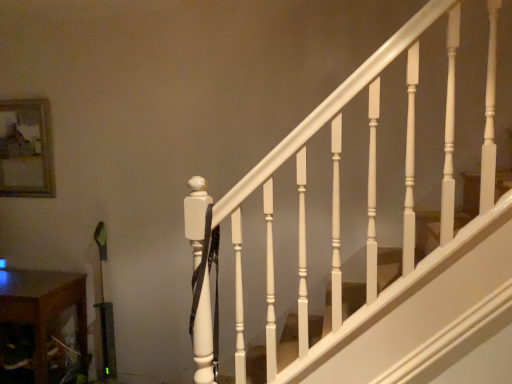
Question: Would you say wooden at lower left is to the left or to the right of wooden frame at upper left in the picture?

Choices:
 (A) left
 (B) right

Answer: (B)

Question: Is wooden at lower left bigger or smaller than wooden frame at upper left?

Choices:
 (A) big
 (B) small

Answer: (A)

Question: In terms of width, does wooden at lower left look wider or thinner when compared to wooden frame at upper left?

Choices:
 (A) wide
 (B) thin

Answer: (A)

Question: Based on their sizes in the image, would you say wooden frame at upper left is bigger or smaller than wooden at lower left?

Choices:
 (A) small
 (B) big

Answer: (A)

Question: Does point click(9, 107) appear closer or farther from the camera than point click(27, 306)?

Choices:
 (A) farther
 (B) closer

Answer: (A)

Question: In the image, is wooden frame at upper left on the left side or the right side of wooden at lower left?

Choices:
 (A) right
 (B) left

Answer: (B)

Question: From the image's perspective, relative to wooden at lower left, is wooden frame at upper left above or below?

Choices:
 (A) below
 (B) above

Answer: (B)